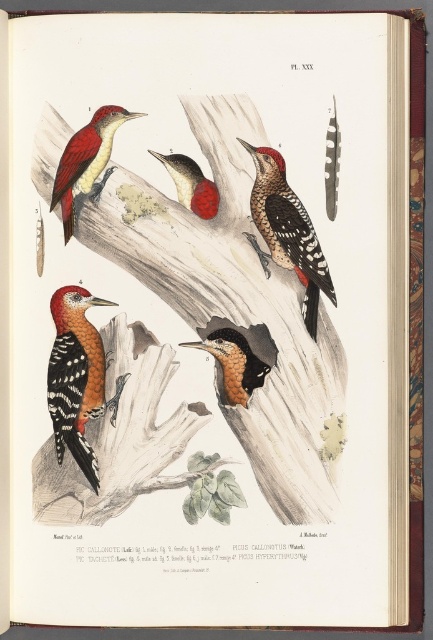
Is point (91, 300) farther from viewer compared to point (310, 308)?

No, it is not.

Who is positioned more to the left, speckled orange woodpecker at center or speckled brown woodpecker at center?

From the viewer's perspective, speckled orange woodpecker at center appears more on the left side.

Where is `speckled orange woodpecker at center`? The width and height of the screenshot is (433, 640). speckled orange woodpecker at center is located at coordinates (76, 376).

Can you confirm if matte red woodpecker at upper left is shorter than smooth red woodpecker at center?

In fact, matte red woodpecker at upper left may be taller than smooth red woodpecker at center.

Find the location of a particular element. matte red woodpecker at upper left is located at coordinates (86, 163).

You are a GUI agent. You are given a task and a screenshot of the screen. Output one action in this format:
    pyautogui.click(x=<x>, y=<y>)
    Task: Click on the matte red woodpecker at upper left
    This screenshot has height=640, width=433.
    Given the screenshot: What is the action you would take?
    pyautogui.click(x=86, y=163)

Find the location of a particular element. matte red woodpecker at upper left is located at coordinates point(86,163).

Between speckled orange woodpecker at center and matte red woodpecker at upper left, which one is positioned lower?

speckled orange woodpecker at center

How much distance is there between speckled orange woodpecker at center and matte red woodpecker at upper left?

speckled orange woodpecker at center is 5.93 inches from matte red woodpecker at upper left.

You are a GUI agent. You are given a task and a screenshot of the screen. Output one action in this format:
    pyautogui.click(x=<x>, y=<y>)
    Task: Click on the speckled orange woodpecker at center
    The image size is (433, 640).
    Given the screenshot: What is the action you would take?
    pyautogui.click(x=76, y=376)